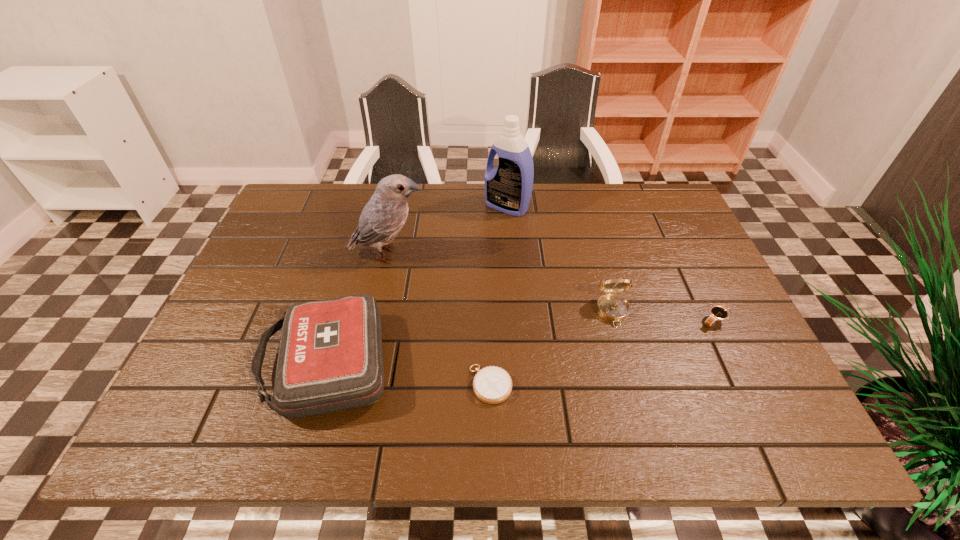
I want to click on free point between the rightmost object and the left compass, so click(603, 352).

This screenshot has height=540, width=960. I want to click on vacant region between the shorter compass and the parrot, so click(440, 319).

You are a GUI agent. You are given a task and a screenshot of the screen. Output one action in this format:
    pyautogui.click(x=<x>, y=<y>)
    Task: Click on the empty space that is in between the first-aid kit and the second shortest object
    
    Given the screenshot: What is the action you would take?
    pyautogui.click(x=521, y=342)

Identify the location of free spot between the right compass and the farthest object. This screenshot has height=540, width=960. (560, 259).

The image size is (960, 540). I want to click on vacant space in between the fifth tallest object and the first-aid kit, so click(521, 342).

What are the coordinates of `empty space that is in between the second shortest object and the first-aid kit` in the screenshot? It's located at (521, 342).

The image size is (960, 540). Identify the location of object that can be found as the closest to the first-aid kit. (492, 384).

I want to click on object that is the closest one to the shorter compass, so click(330, 358).

Find the location of a particular element. The image size is (960, 540). vacant region that satisfies the following two spatial constraints: 1. on the front-facing side of the fifth shortest object; 2. on the back side of the shorter compass is located at coordinates click(361, 384).

The height and width of the screenshot is (540, 960). What are the coordinates of `free space that satisfies the following two spatial constraints: 1. on the front side of the farthest object; 2. on the front-facing side of the parrot` in the screenshot? It's located at (511, 254).